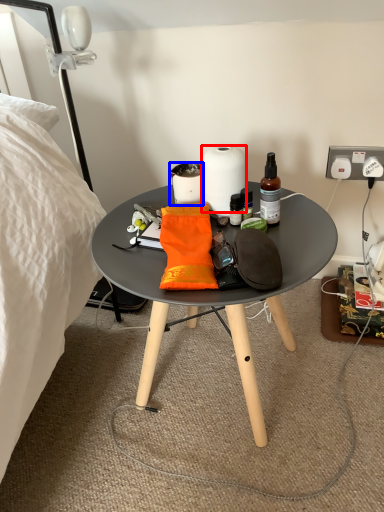
Question: Which object is closer to the camera taking this photo, paper towel (highlighted by a red box) or coffee cup (highlighted by a blue box)?

Choices:
 (A) paper towel
 (B) coffee cup

Answer: (A)